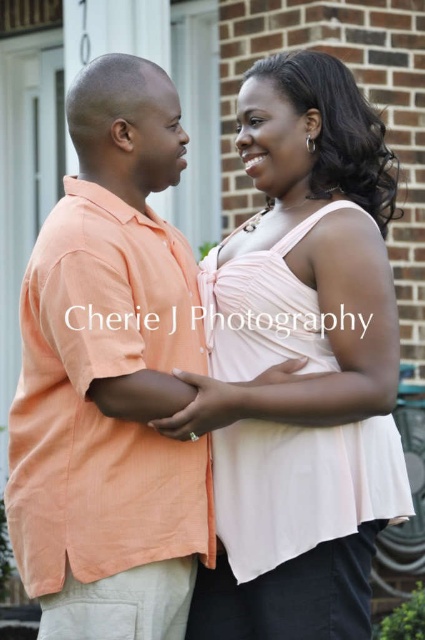
Between point (368, 394) and point (105, 600), which one is positioned in front?

Positioned in front is point (105, 600).

Based on the photo, does matte pink dress at center have a lesser height compared to orange linen shirt at left?

No, matte pink dress at center is not shorter than orange linen shirt at left.

Between point (269, 272) and point (67, 609), which one is positioned behind?

The point (269, 272) is more distant.

Where is `matte pink dress at center`? The width and height of the screenshot is (425, 640). matte pink dress at center is located at coordinates (302, 369).